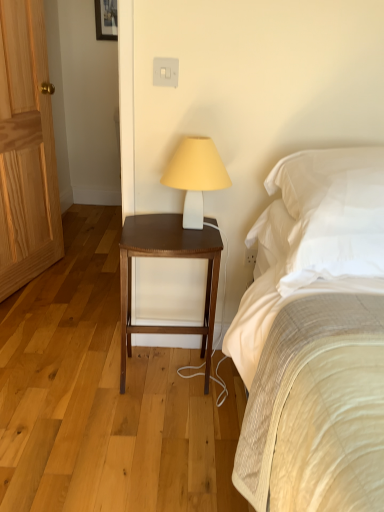
You are a GUI agent. You are given a task and a screenshot of the screen. Output one action in this format:
    pyautogui.click(x=<x>, y=<y>)
    Task: Click on the blank area beneath dark wood nightstand at center (from a real-world perspective)
    The image size is (384, 512).
    Given the screenshot: What is the action you would take?
    pyautogui.click(x=169, y=376)